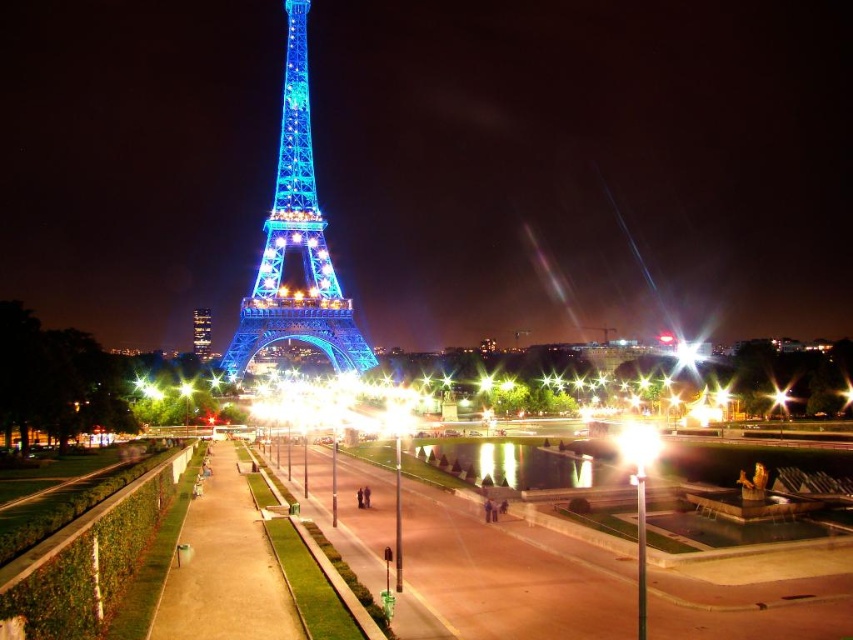
You are standing at the edge of the walkway near the lampposts and want to take a photo of the shiny blue metal eiffel tower at center. If your camera can focus on objects up to 200 meters away, will you be able to capture a clear image of the tower?

The distance between you and the shiny blue metal eiffel tower at center is 157.76 meters, which is within the camera focus range of 200 meters. Therefore, you can capture a clear image of the tower.

Consider the image. You are standing on the pedestrian walkway near the green hedges. You want to walk straight towards the shiny blue metal eiffel tower at center. Which direction should you head relative to the lampposts on the other side of the walkway?

Since the shiny blue metal eiffel tower at center is positioned at point (x=296, y=243), you should head towards the direction where the lampposts on the other side of the walkway are aligned with that coordinate to reach the tower directly.

You are standing on the pedestrian walkway and want to take a photo of the Eiffel Tower. There are two points marked on your camera screen at coordinates point (x=270, y=333) and point (x=202, y=323). Which point is closer to your current position?

Point (x=270, y=333) is closer to the camera than point (x=202, y=323), so the point (x=270, y=333) is closer to your current position.